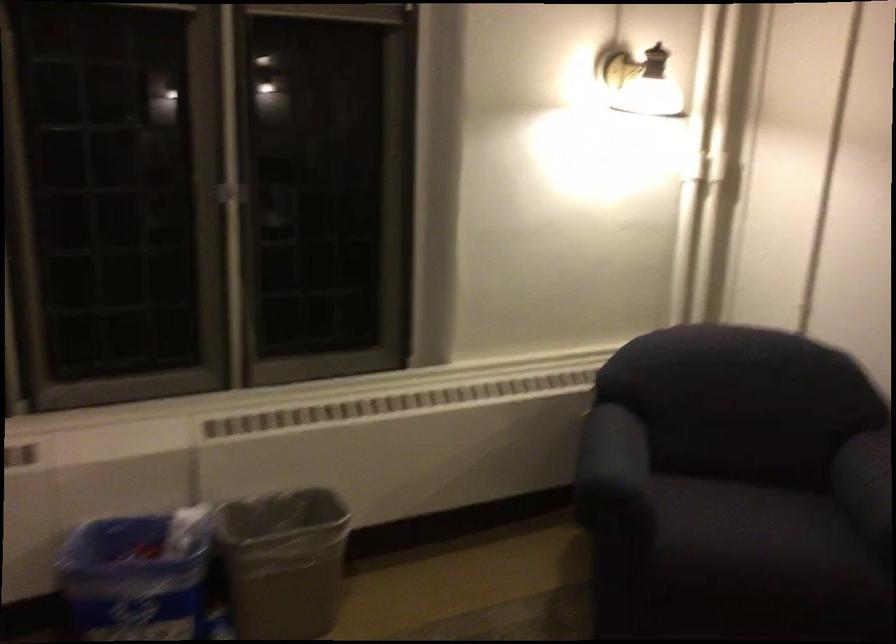
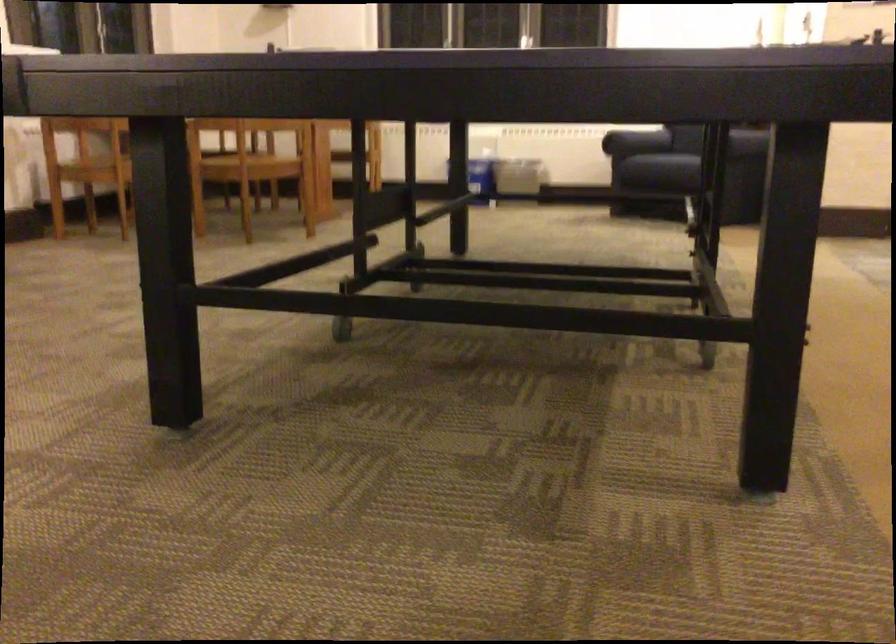
Where in the second image is the point corresponding to point (704, 536) from the first image?

(633, 143)